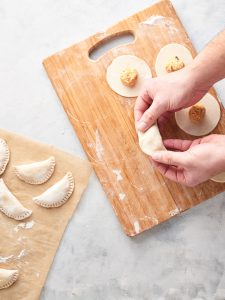
Find the location of a particular element. This screenshot has width=225, height=300. cutting board handle is located at coordinates (105, 51).